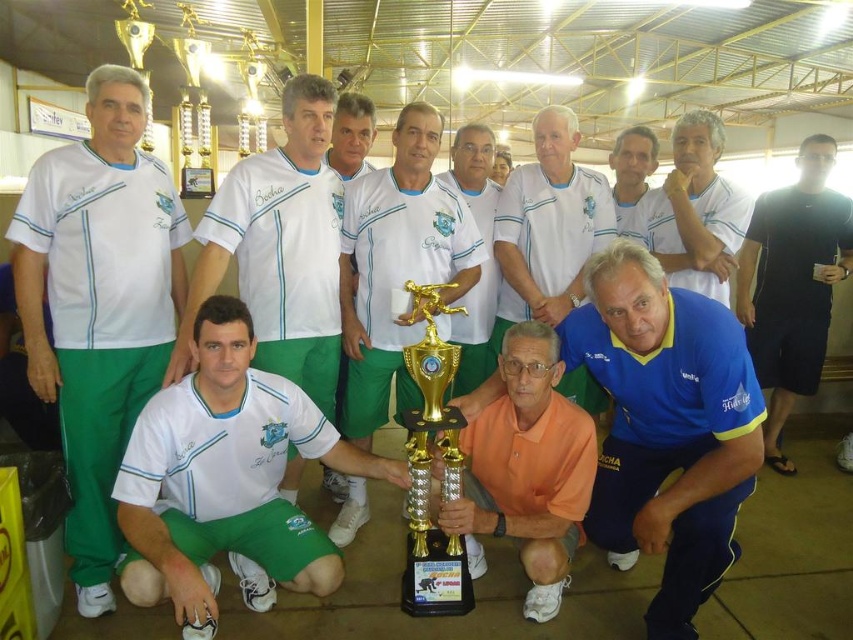
Question: Which object is closer to the camera taking this photo?

Choices:
 (A) white matte jersey at center
 (B) blue jersey at center
 (C) gold metallic trophy at center
 (D) matte white shirt at center

Answer: (A)

Question: Which point appears farthest from the camera in this image?

Choices:
 (A) (703, 424)
 (B) (819, 246)
 (C) (711, 168)

Answer: (B)

Question: Which point is farther to the camera?

Choices:
 (A) (459, 554)
 (B) (618, 500)

Answer: (B)

Question: Does blue jersey at center have a lesser width compared to white matte jersey at center?

Choices:
 (A) no
 (B) yes

Answer: (A)

Question: From the image, what is the correct spatial relationship of white matte jersey at center in relation to matte white shirt at center?

Choices:
 (A) above
 (B) below

Answer: (B)

Question: Observing the image, what is the correct spatial positioning of blue jersey at center in reference to white matte jersey at center?

Choices:
 (A) left
 (B) right

Answer: (B)